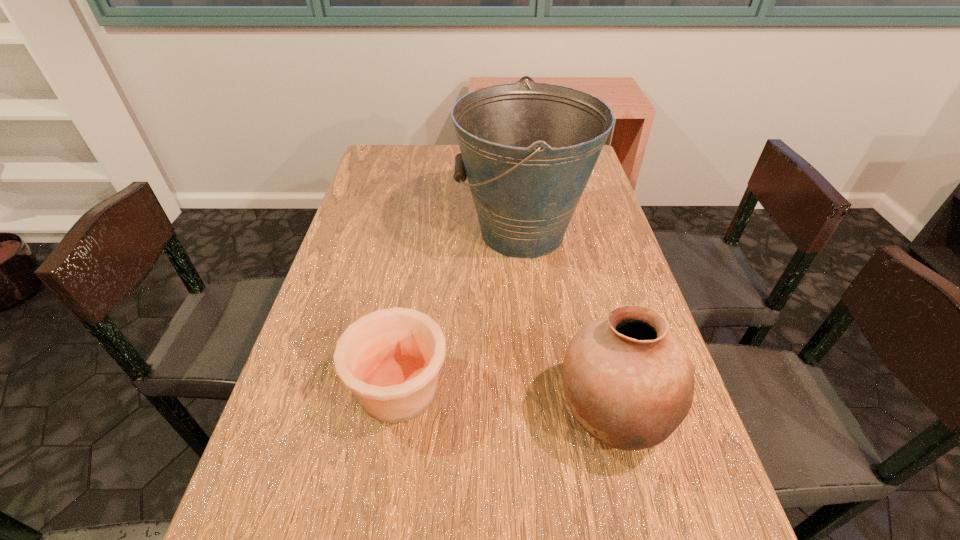
The width and height of the screenshot is (960, 540). Find the location of `the farthest object`. the farthest object is located at coordinates (528, 150).

Locate an element on the screen. The height and width of the screenshot is (540, 960). the tallest object is located at coordinates (528, 150).

The height and width of the screenshot is (540, 960). Find the location of `the taller pottery`. the taller pottery is located at coordinates (629, 382).

Identify the location of the right pottery. (629, 382).

Where is `the shortest object`? This screenshot has width=960, height=540. the shortest object is located at coordinates pos(390,358).

Image resolution: width=960 pixels, height=540 pixels. Identify the location of the shorter pottery. (390, 358).

Find the location of a particular element. Image resolution: width=960 pixels, height=540 pixels. vacant space located with the handle on opposite sides of the farthest object is located at coordinates (431, 233).

This screenshot has width=960, height=540. I want to click on vacant space situated with the handle on opposite sides of the farthest object, so click(343, 233).

I want to click on vacant region located with the handle on opposite sides of the farthest object, so click(x=371, y=233).

Locate an element on the screen. This screenshot has height=540, width=960. vacant point located on the left of the taller pottery is located at coordinates (509, 413).